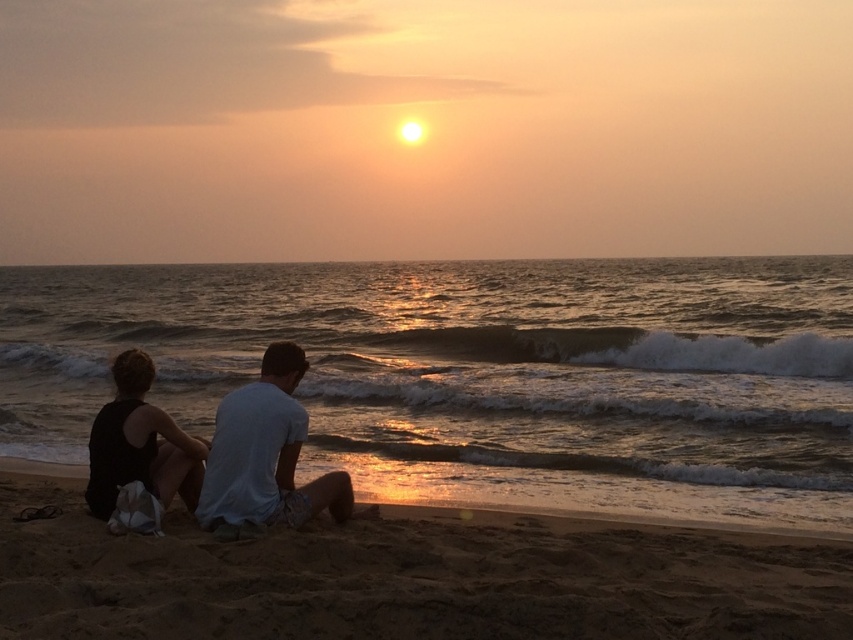
Who is lower down, fine-grained sand at lower center or white cotton shirt at center?

fine-grained sand at lower center

Is fine-grained sand at lower center shorter than white cotton shirt at center?

Yes.

What do you see at coordinates (409, 579) in the screenshot? Image resolution: width=853 pixels, height=640 pixels. I see `fine-grained sand at lower center` at bounding box center [409, 579].

Locate an element on the screen. fine-grained sand at lower center is located at coordinates (409, 579).

Which of these two, fine-grained sand at lower center or black fabric dress at lower left, stands shorter?

With less height is fine-grained sand at lower center.

Which is below, fine-grained sand at lower center or black fabric dress at lower left?

fine-grained sand at lower center

Where is `fine-grained sand at lower center`? Image resolution: width=853 pixels, height=640 pixels. fine-grained sand at lower center is located at coordinates (409, 579).

Identify the location of fine-grained sand at lower center. The height and width of the screenshot is (640, 853). (409, 579).

In the scene shown: Does white cotton shirt at center appear on the left side of black fabric dress at lower left?

No, white cotton shirt at center is not to the left of black fabric dress at lower left.

Does white cotton shirt at center have a smaller size compared to black fabric dress at lower left?

Incorrect, white cotton shirt at center is not smaller in size than black fabric dress at lower left.

Between point (230, 429) and point (160, 486), which one is positioned in front?

Point (230, 429) is more forward.

Locate an element on the screen. The width and height of the screenshot is (853, 640). white cotton shirt at center is located at coordinates pyautogui.click(x=265, y=452).